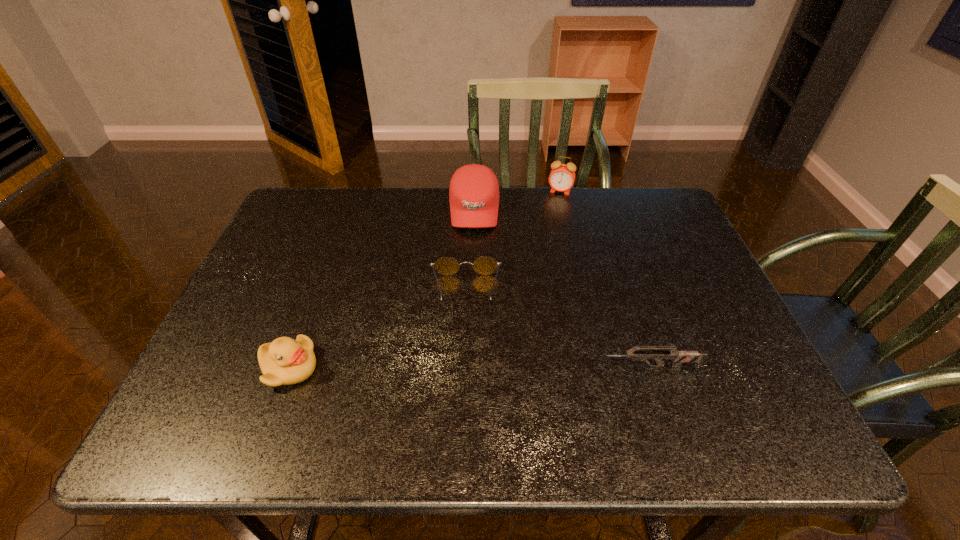
Locate an element on the screen. The image size is (960, 540). vacant space in between the cap and the third farthest object is located at coordinates (470, 251).

What are the coordinates of `free space between the cap and the alarm clock` in the screenshot? It's located at (517, 200).

This screenshot has height=540, width=960. I want to click on object that is the third closest to the third farthest object, so click(679, 357).

Where is `object that ranks as the fourth closest to the gun`? The height and width of the screenshot is (540, 960). object that ranks as the fourth closest to the gun is located at coordinates (562, 177).

Find the location of a particular element. The image size is (960, 540). free location that satisfies the following two spatial constraints: 1. on the back side of the alarm clock; 2. on the right side of the cap is located at coordinates (474, 191).

Identify the location of free space that satisfies the following two spatial constraints: 1. on the front side of the third farthest object; 2. aimed along the barrel of the gun. The height and width of the screenshot is (540, 960). (464, 367).

In order to click on vacant region that satisfies the following two spatial constraints: 1. on the back side of the cap; 2. on the right side of the alarm clock in this screenshot , I will do `click(474, 191)`.